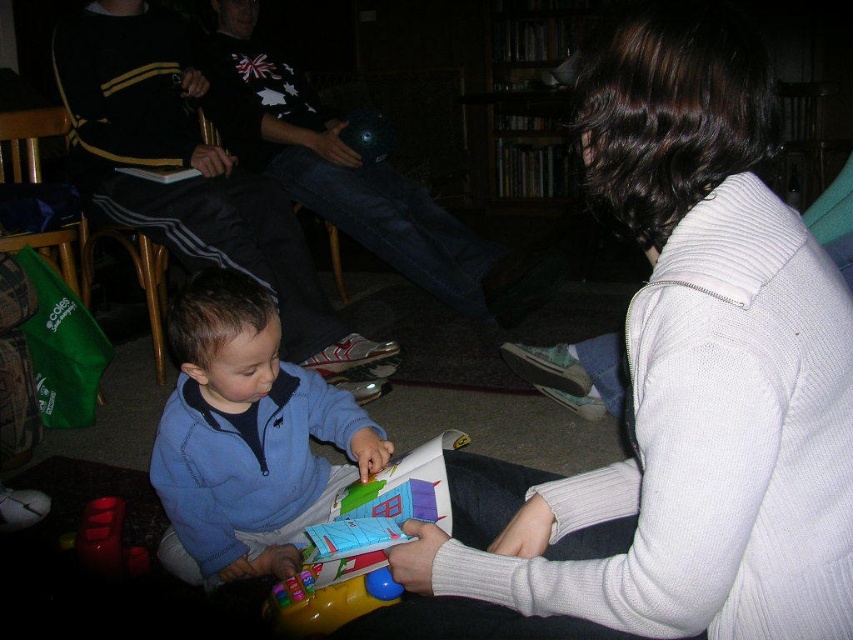
Does blue fleece jacket at center have a greater height compared to rubberized red toy at lower left?

Correct, blue fleece jacket at center is much taller as rubberized red toy at lower left.

Is blue fleece jacket at center shorter than rubberized red toy at lower left?

No, blue fleece jacket at center is not shorter than rubberized red toy at lower left.

Between point (367, 438) and point (122, 504), which one is positioned behind?

Point (122, 504)

You are a GUI agent. You are given a task and a screenshot of the screen. Output one action in this format:
    pyautogui.click(x=<x>, y=<y>)
    Task: Click on the blue fleece jacket at center
    The height and width of the screenshot is (640, 853).
    Given the screenshot: What is the action you would take?
    [x=247, y=436]

Between white ribbed sweater at center and rubberized red toy at lower left, which one has less height?

rubberized red toy at lower left is shorter.

Who is more distant from viewer, [804,534] or [131,568]?

Point [131,568]

Between point (650, 154) and point (102, 524), which one is positioned behind?

Point (102, 524)

The height and width of the screenshot is (640, 853). I want to click on white ribbed sweater at center, so click(x=679, y=385).

Is blue fleece jacket at center wider than plastic colorful toy at center?

Correct, the width of blue fleece jacket at center exceeds that of plastic colorful toy at center.

Does blue fleece jacket at center appear under plastic colorful toy at center?

Incorrect, blue fleece jacket at center is not positioned below plastic colorful toy at center.

Is point (202, 520) behind point (347, 572)?

Yes, it is.

Locate an element on the screen. The height and width of the screenshot is (640, 853). blue fleece jacket at center is located at coordinates (247, 436).